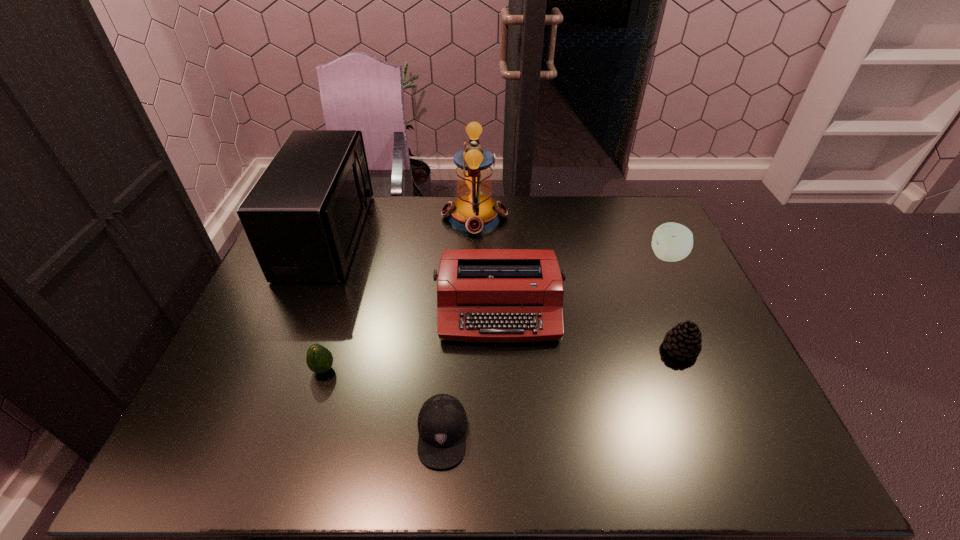
Identify the location of lantern. Image resolution: width=960 pixels, height=540 pixels. (474, 211).

Identify the location of the sixth shortest object. (303, 217).

Identify the location of apple. This screenshot has width=960, height=540. (671, 242).

The width and height of the screenshot is (960, 540). Identify the location of typewriter. (483, 295).

This screenshot has height=540, width=960. In order to click on pinecone in this screenshot , I will do `click(684, 340)`.

Locate an element on the screen. Image resolution: width=960 pixels, height=540 pixels. avocado is located at coordinates (319, 359).

The height and width of the screenshot is (540, 960). What are the coordinates of `the shortest object` in the screenshot? It's located at (442, 422).

The width and height of the screenshot is (960, 540). What are the coordinates of `the nearest object` in the screenshot? It's located at (442, 422).

Where is `free space located on the front-facing side of the lantern`? Image resolution: width=960 pixels, height=540 pixels. free space located on the front-facing side of the lantern is located at coordinates (556, 217).

This screenshot has width=960, height=540. Identify the location of free location located 0.370m on the front-facing side of the microwave_oven. (475, 235).